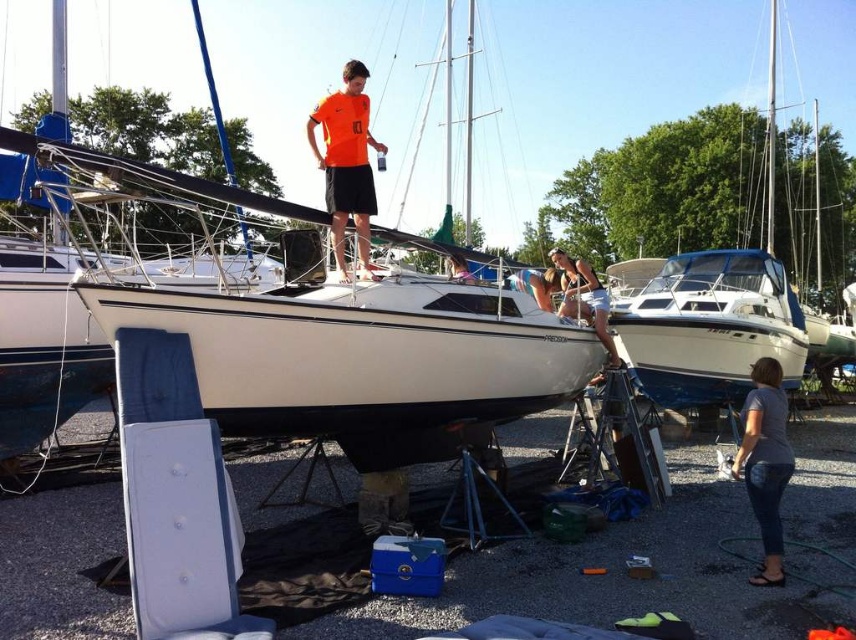
Question: In this image, where is orange matte shirt at center located relative to gray cotton shirt at lower right?

Choices:
 (A) right
 (B) left

Answer: (B)

Question: Is orange matte shirt at center closer to the viewer compared to gray cotton shirt at lower right?

Choices:
 (A) no
 (B) yes

Answer: (A)

Question: Which is nearer to the gray cotton shirt at lower right?

Choices:
 (A) matte white tank top at center
 (B) white glossy boat at center

Answer: (A)

Question: Which of these objects is positioned farthest from the matte white tank top at center?

Choices:
 (A) orange matte shirt at center
 (B) white glossy boat at center
 (C) gray cotton shirt at lower right

Answer: (B)

Question: Which of the following is the farthest from the observer?

Choices:
 (A) white glossy boat at center
 (B) matte white tank top at center
 (C) orange matte shirt at center
 (D) gray cotton shirt at lower right

Answer: (A)

Question: Can you confirm if white glossy boat at center is smaller than gray cotton shirt at lower right?

Choices:
 (A) yes
 (B) no

Answer: (B)